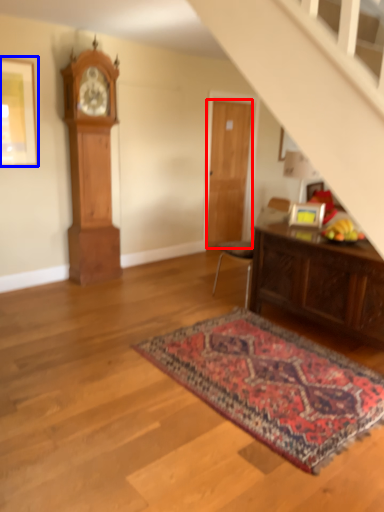
Question: Among these objects, which one is farthest to the camera, door (highlighted by a red box) or picture frame (highlighted by a blue box)?

Choices:
 (A) door
 (B) picture frame

Answer: (A)